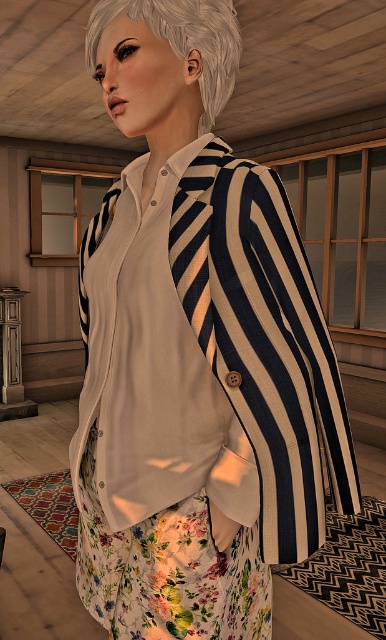
Which is above, striped fabric tie at center or white matte tie at center?

Positioned higher is white matte tie at center.

From the picture: Is striped fabric tie at center below white matte tie at center?

Correct, striped fabric tie at center is located below white matte tie at center.

Identify the location of striped fabric tie at center. The image size is (386, 640). (196, 244).

Is white matte hair at upper center further to the viewer compared to white matte tie at center?

No, white matte hair at upper center is closer to the viewer.

Can you confirm if white matte hair at upper center is positioned above white matte tie at center?

Correct, white matte hair at upper center is located above white matte tie at center.

Between point (230, 68) and point (101, 230), which one is positioned behind?

The point (101, 230) is behind.

Identify the location of white matte hair at upper center. (182, 40).

Does point (162, 20) come in front of point (199, 179)?

Yes, it is.

The width and height of the screenshot is (386, 640). Describe the element at coordinates (182, 40) in the screenshot. I see `white matte hair at upper center` at that location.

Find the location of `white matte hair at upper center`. white matte hair at upper center is located at coordinates (182, 40).

I want to click on white matte hair at upper center, so click(182, 40).